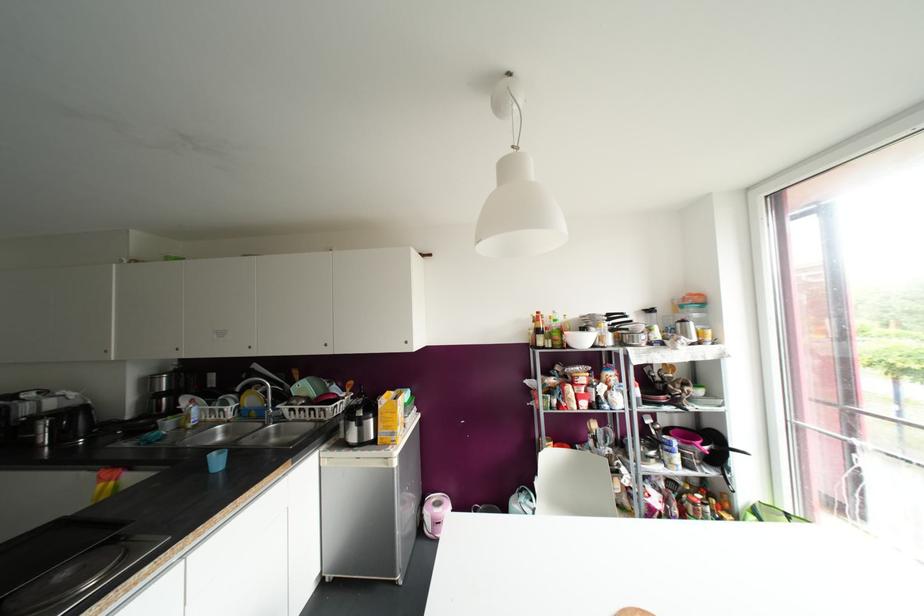
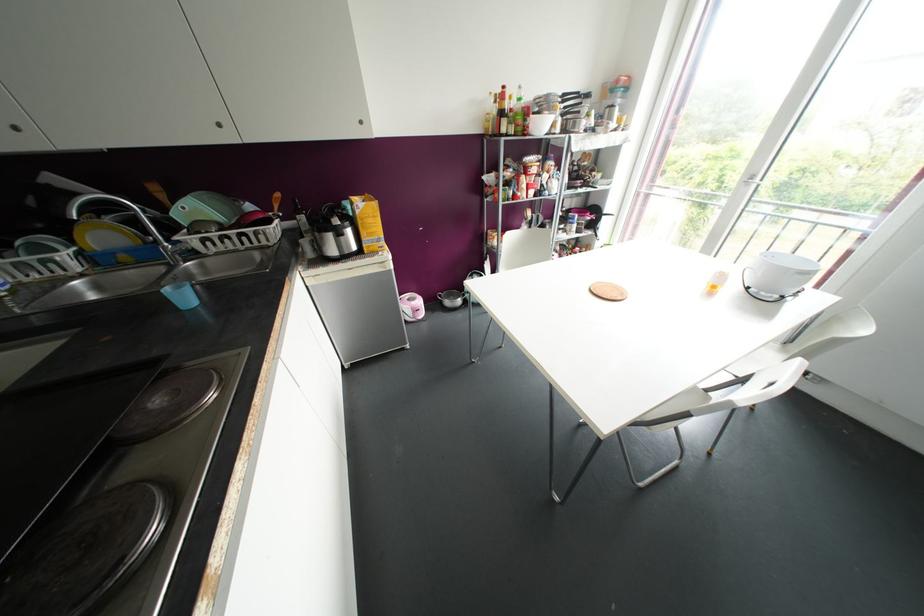
Find the pixel in the second image that matches point (387, 415) in the first image.

(370, 220)